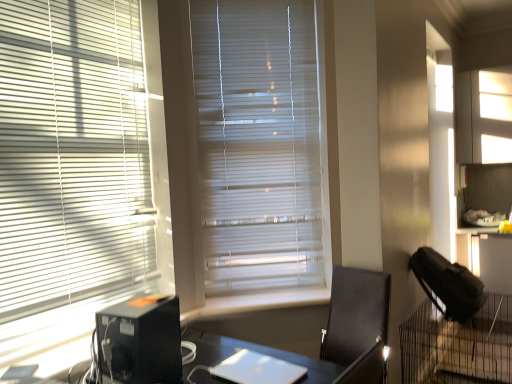
Question: Do you think black plastic computer tower at lower left is within silver metallic laptop at center, or outside of it?

Choices:
 (A) inside
 (B) outside

Answer: (B)

Question: In terms of size, does black plastic computer tower at lower left appear bigger or smaller than silver metallic laptop at center?

Choices:
 (A) small
 (B) big

Answer: (B)

Question: Which is farther from the black leather chair at center?

Choices:
 (A) silver metallic laptop at center
 (B) white smooth window sill at center
 (C) black plastic computer tower at lower left
 (D) black mesh cage at lower right
 (E) white matte blinds at center, which ranks as the 1th window blind in right-to-left order

Answer: (D)

Question: Which object is positioned closest to the silver metallic laptop at center?

Choices:
 (A) white matte blinds at left, marked as the 2th window blind in a right-to-left arrangement
 (B) black plastic computer tower at lower left
 (C) white matte blinds at center, which is the second window blind from left to right
 (D) white smooth window sill at center
 (E) black mesh cage at lower right

Answer: (B)